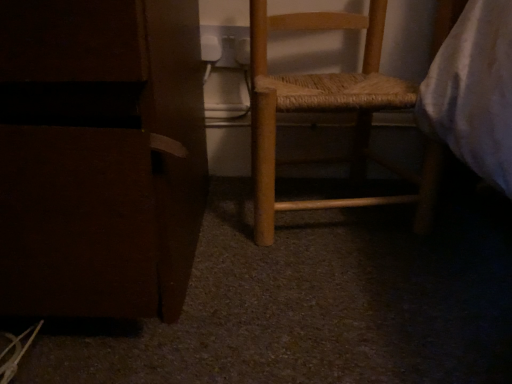
Question: In terms of width, does wooden woven seat at center, arranged as the 1th furniture when viewed from the right, look wider or thinner when compared to matte brown cabinet at left, placed as the first furniture when sorted from left to right?

Choices:
 (A) wide
 (B) thin

Answer: (B)

Question: From their relative heights in the image, would you say wooden woven seat at center, arranged as the 1th furniture when viewed from the right, is taller or shorter than matte brown cabinet at left, placed as the first furniture when sorted from left to right?

Choices:
 (A) tall
 (B) short

Answer: (A)

Question: In the image, is wooden woven seat at center, arranged as the 1th furniture when viewed from the right, positioned in front of or behind matte brown cabinet at left, placed as the first furniture when sorted from left to right?

Choices:
 (A) front
 (B) behind

Answer: (B)

Question: In the image, is matte brown cabinet at left, placed as the 2th furniture when sorted from right to left, positioned in front of or behind wooden woven seat at center, marked as the 2th furniture in a left-to-right arrangement?

Choices:
 (A) front
 (B) behind

Answer: (A)

Question: Is matte brown cabinet at left, placed as the 2th furniture when sorted from right to left, wider or thinner than wooden woven seat at center, arranged as the 1th furniture when viewed from the right?

Choices:
 (A) thin
 (B) wide

Answer: (B)

Question: Would you say matte brown cabinet at left, placed as the 2th furniture when sorted from right to left, is inside or outside wooden woven seat at center, arranged as the 1th furniture when viewed from the right?

Choices:
 (A) outside
 (B) inside

Answer: (A)

Question: From a real-world perspective, is matte brown cabinet at left, placed as the 2th furniture when sorted from right to left, positioned above or below wooden woven seat at center, arranged as the 1th furniture when viewed from the right?

Choices:
 (A) below
 (B) above

Answer: (B)